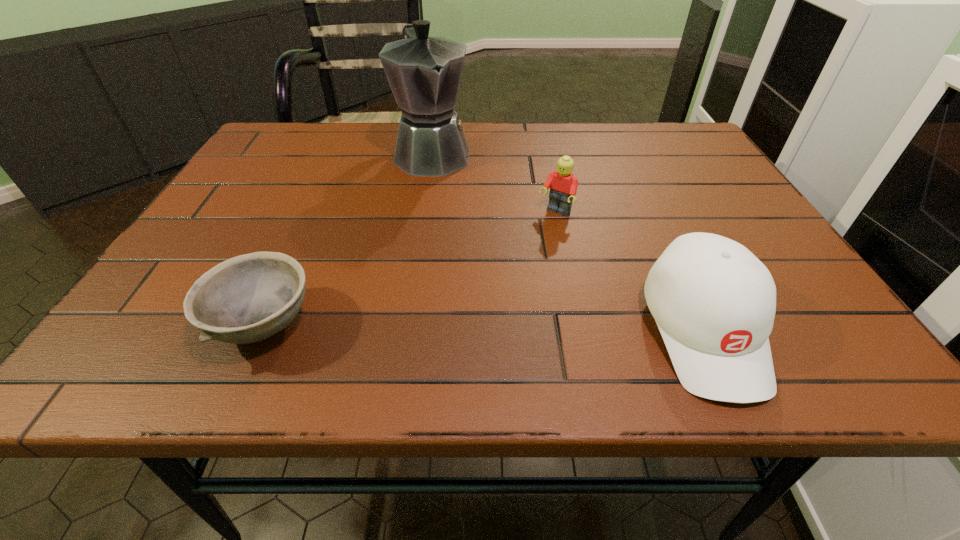
Where is `empty space between the rightmost object and the second object from right to left`? Image resolution: width=960 pixels, height=540 pixels. empty space between the rightmost object and the second object from right to left is located at coordinates (630, 272).

Where is `empty space that is in between the baseball cap and the tallest object`? The height and width of the screenshot is (540, 960). empty space that is in between the baseball cap and the tallest object is located at coordinates (568, 242).

Find the location of `empty location between the Lego and the tallest object`. empty location between the Lego and the tallest object is located at coordinates (494, 183).

At what (x,y) coordinates should I click in order to perform the action: click on free space that is in between the rightmost object and the third object from right to left. Please return your answer as a coordinate pair (x, y). This screenshot has height=540, width=960. Looking at the image, I should click on (568, 242).

The height and width of the screenshot is (540, 960). In order to click on empty space that is in between the farthest object and the shortest object in this screenshot , I will do `click(348, 239)`.

I want to click on unoccupied area between the coffeepot and the bowl, so click(348, 239).

The image size is (960, 540). I want to click on vacant area that lies between the Lego and the farthest object, so click(x=494, y=183).

Find the location of a particular element. This screenshot has width=960, height=540. object that stands as the third closest to the tallest object is located at coordinates (714, 302).

Select which object is the second closest to the farthest object. Please provide its 2D coordinates. Your answer should be formatted as a tuple, i.e. [(x, y)], where the tuple contains the x and y coordinates of a point satisfying the conditions above.

[(248, 298)]

Find the location of a particular element. The height and width of the screenshot is (540, 960). vacant point that satisfies the following two spatial constraints: 1. on the back side of the shortest object; 2. on the left side of the second object from right to left is located at coordinates (315, 212).